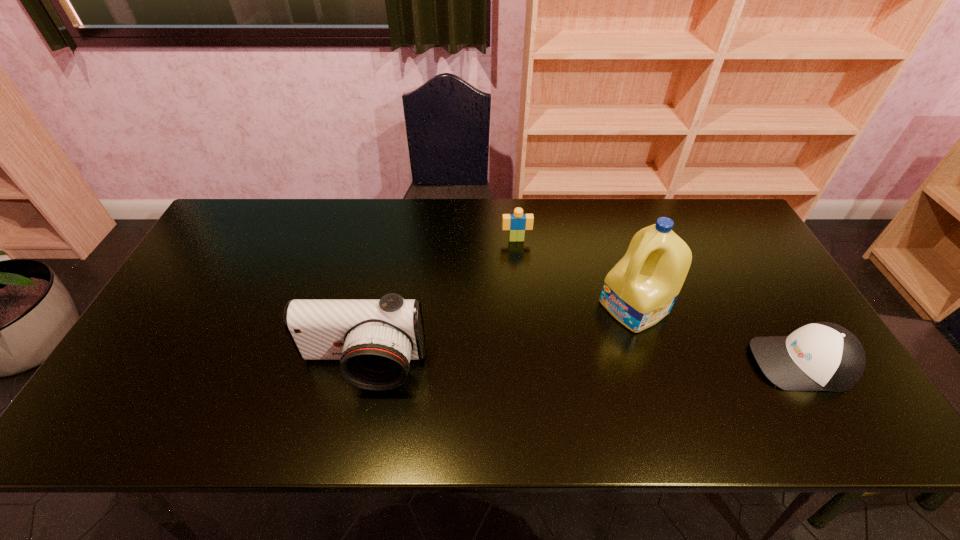
Image resolution: width=960 pixels, height=540 pixels. In order to click on camcorder in this screenshot , I will do `click(374, 339)`.

Identify the location of the leftmost object. The height and width of the screenshot is (540, 960). (374, 339).

Where is `the rightmost object`? This screenshot has height=540, width=960. the rightmost object is located at coordinates (821, 356).

Image resolution: width=960 pixels, height=540 pixels. I want to click on detergent, so click(640, 290).

Identify the location of the second object from right to left. The image size is (960, 540). (640, 290).

Locate an element on the screen. The width and height of the screenshot is (960, 540). Lego is located at coordinates (517, 223).

Locate an element on the screen. the second object from left to right is located at coordinates (517, 223).

Where is `free location located on the front panel of the cap`? free location located on the front panel of the cap is located at coordinates (656, 363).

The height and width of the screenshot is (540, 960). In order to click on vacant space located 0.260m on the front panel of the cap in this screenshot , I will do `click(648, 363)`.

Image resolution: width=960 pixels, height=540 pixels. I want to click on vacant space situated 0.330m on the front panel of the cap, so click(619, 363).